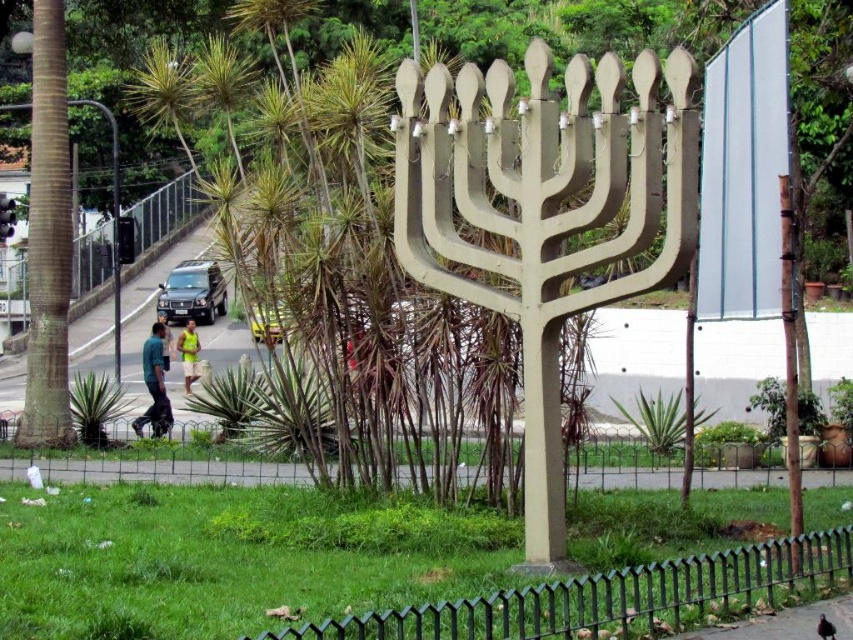
You are standing at the base of the menorah sculpture in the park. There are two points marked on the ground around you, labeled as point (738, 474) and point (178, 336). If you want to walk towards the road with vehicles, which point should you step on first?

You should step on point (738, 474) first because it is in front of point (178, 336), meaning it is closer to the road with vehicles.

Consider the image. You are a delivery person with a cart that is 5 meters wide. You need to move through the space between the green metal fence at lower center and the black wire fence at lower center. Can your cart fit through the gap between them?

The gap between the green metal fence at lower center and the black wire fence at lower center is 5.22 meters. Since your cart is 5 meters wide, it can fit through the gap as the space is slightly wider than the cart.